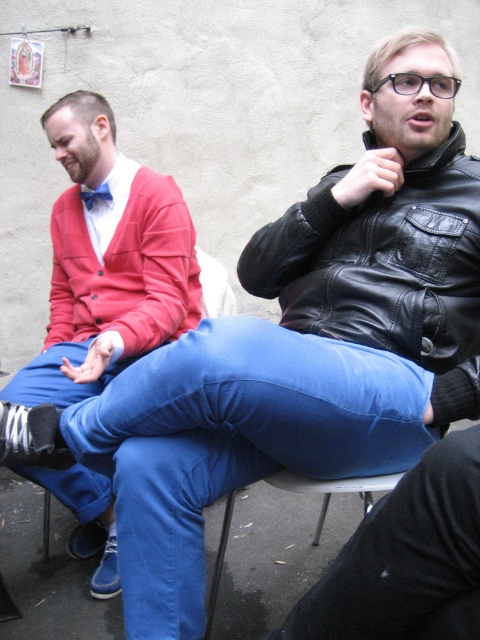
Is metallic blue chair at center closer to the viewer compared to blue satin bow tie at upper left?

No, it is not.

Describe the element at coordinates (215, 288) in the screenshot. This screenshot has width=480, height=640. I see `metallic blue chair at center` at that location.

What do you see at coordinates (215, 288) in the screenshot? I see `metallic blue chair at center` at bounding box center [215, 288].

Where is `metallic blue chair at center`? Image resolution: width=480 pixels, height=640 pixels. metallic blue chair at center is located at coordinates (215, 288).

From the picture: Does black leather jacket at upper right appear over blue satin bow tie at upper left?

Actually, black leather jacket at upper right is below blue satin bow tie at upper left.

Is black leather jacket at upper right smaller than blue satin bow tie at upper left?

No.

The image size is (480, 640). What are the coordinates of `black leather jacket at upper right` in the screenshot? It's located at (386, 269).

Locate an element on the screen. This screenshot has height=640, width=480. black leather jacket at upper right is located at coordinates (386, 269).

This screenshot has height=640, width=480. Describe the element at coordinates (386, 269) in the screenshot. I see `black leather jacket at upper right` at that location.

Can you confirm if black leather jacket at upper right is wider than metallic blue chair at center?

Correct, the width of black leather jacket at upper right exceeds that of metallic blue chair at center.

In order to click on black leather jacket at upper right in this screenshot , I will do `click(386, 269)`.